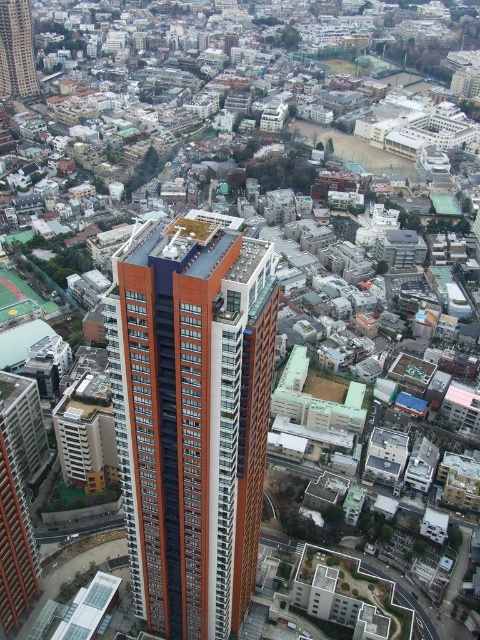
Question: Where is orange glassy building at center located in relation to orange glass tower at center in the image?

Choices:
 (A) right
 (B) left

Answer: (A)

Question: Which point is farther to the camera?

Choices:
 (A) orange glassy building at center
 (B) orange glass tower at center

Answer: (B)

Question: Which object is farther from the camera taking this photo?

Choices:
 (A) orange glass tower at center
 (B) orange glassy building at center

Answer: (A)

Question: Can you confirm if orange glassy building at center is bigger than orange glass tower at center?

Choices:
 (A) no
 (B) yes

Answer: (B)

Question: Which point is farther to the camera?

Choices:
 (A) orange glass tower at center
 (B) orange glassy building at center

Answer: (A)

Question: Can you confirm if orange glassy building at center is positioned below orange glass tower at center?

Choices:
 (A) yes
 (B) no

Answer: (A)